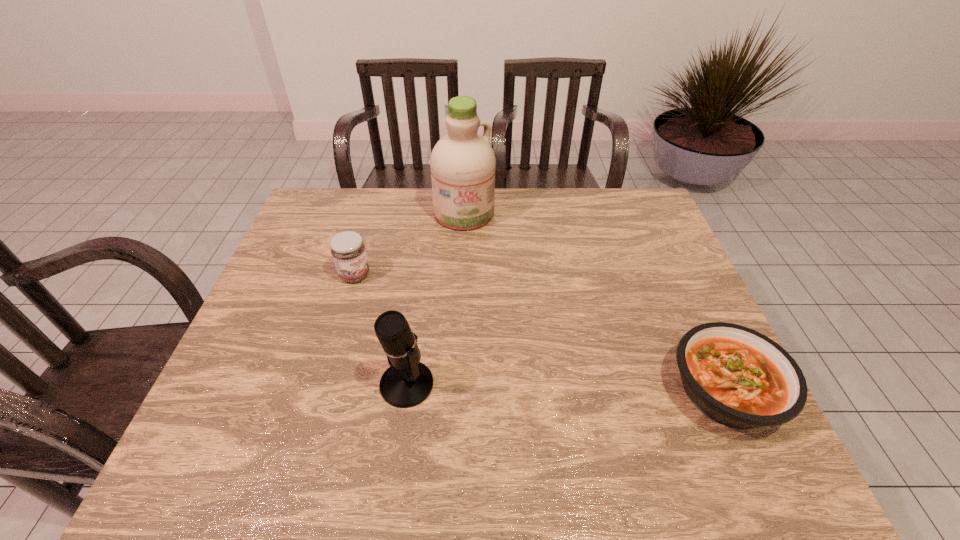
This screenshot has height=540, width=960. Identify the location of microphone. (407, 382).

You are a GUI agent. You are given a task and a screenshot of the screen. Output one action in this format:
    pyautogui.click(x=<x>, y=<y>)
    Task: Click on the rightmost object
    The height and width of the screenshot is (540, 960).
    Given the screenshot: What is the action you would take?
    pyautogui.click(x=738, y=377)

Locate an element on the screen. This screenshot has width=960, height=540. stew is located at coordinates (738, 377).

Locate an element on the screen. The width and height of the screenshot is (960, 540). the leftmost object is located at coordinates (348, 251).

The height and width of the screenshot is (540, 960). In order to click on jam in this screenshot , I will do `click(348, 251)`.

The width and height of the screenshot is (960, 540). I want to click on cleansing agent, so click(462, 163).

Where is `the tallest object`? The image size is (960, 540). the tallest object is located at coordinates (462, 163).

Locate an element on the screen. free region located 0.110m on the left of the microphone is located at coordinates (331, 384).

Image resolution: width=960 pixels, height=540 pixels. I want to click on free space located 0.260m on the back of the rightmost object, so click(671, 272).

Identify the location of vacant space positioned on the front label of the leftmost object. (388, 296).